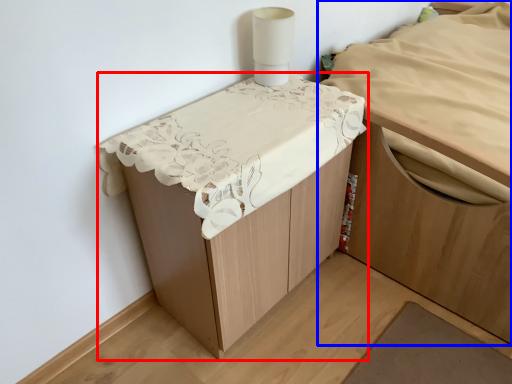
Question: Among these objects, which one is farthest to the camera, furniture (highlighted by a red box) or furniture (highlighted by a blue box)?

Choices:
 (A) furniture
 (B) furniture

Answer: (B)